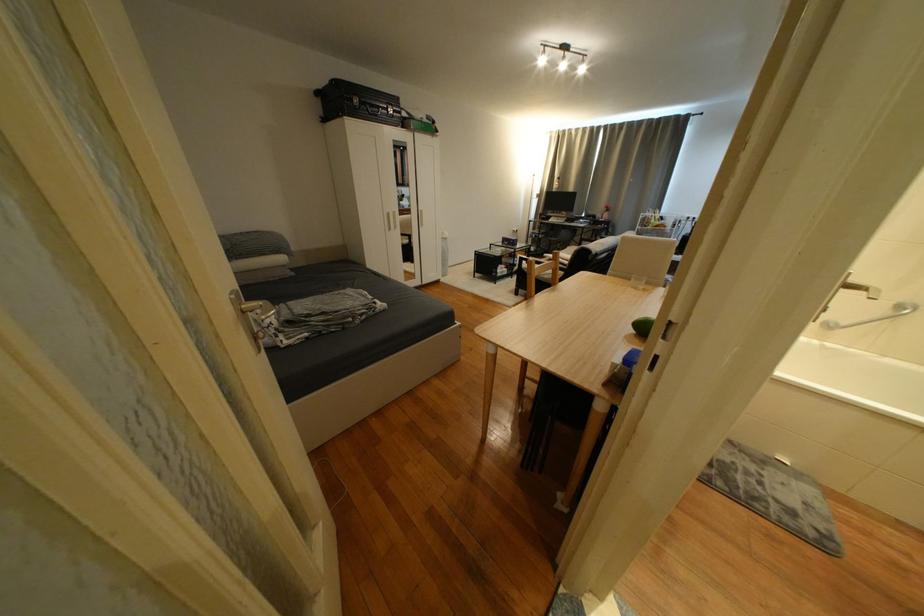
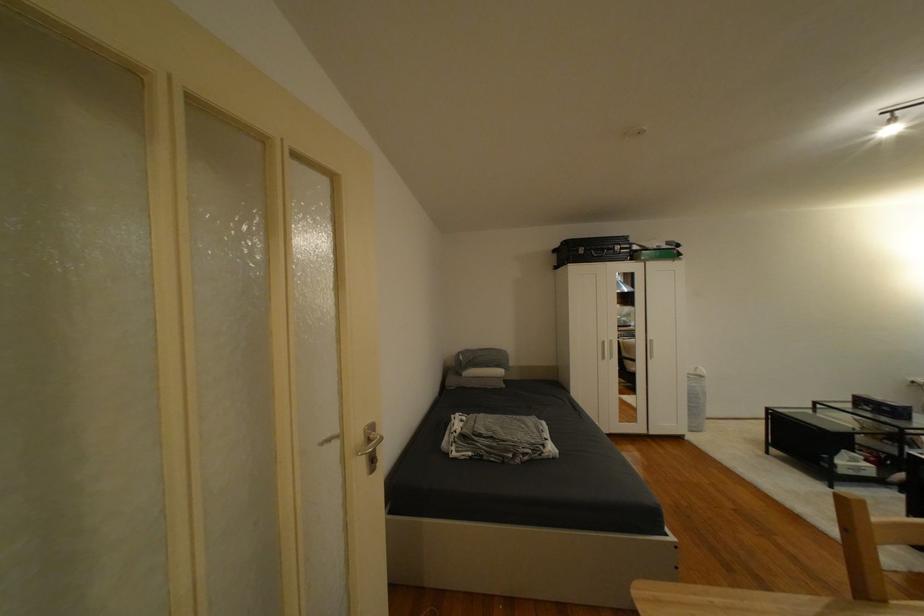
In the second image, find the point that corresponds to [332,106] in the first image.

(565, 257)